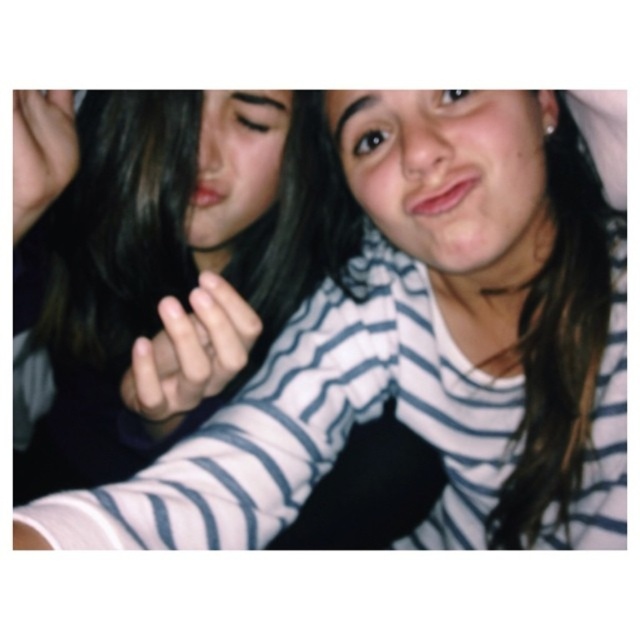
Question: Is smooth skin hand at center closer to the viewer compared to smooth skin hand at upper left?

Choices:
 (A) no
 (B) yes

Answer: (B)

Question: Can you confirm if smooth skin hand at center is positioned below smooth skin hand at upper left?

Choices:
 (A) yes
 (B) no

Answer: (A)

Question: Which object is closer to the camera taking this photo?

Choices:
 (A) smooth skin hand at center
 (B) white striped shirt at center

Answer: (B)

Question: Based on their relative distances, which object is farther from the white striped shirt at center?

Choices:
 (A) smooth skin hand at center
 (B) smooth skin hand at upper left

Answer: (B)

Question: Where is white striped shirt at center located in relation to smooth skin hand at center in the image?

Choices:
 (A) above
 (B) below

Answer: (A)

Question: Which point is closer to the camera?

Choices:
 (A) smooth skin hand at upper left
 (B) smooth skin hand at center

Answer: (B)